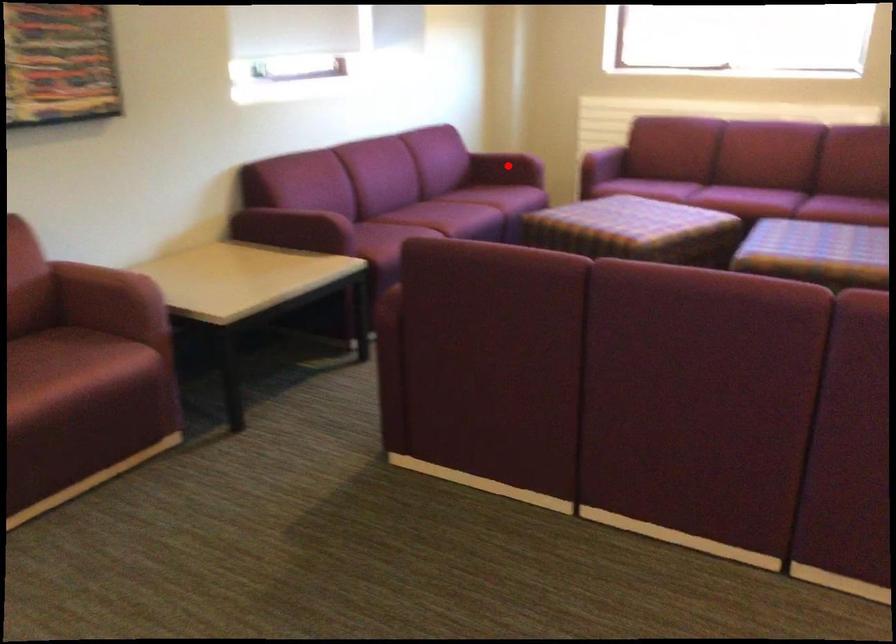
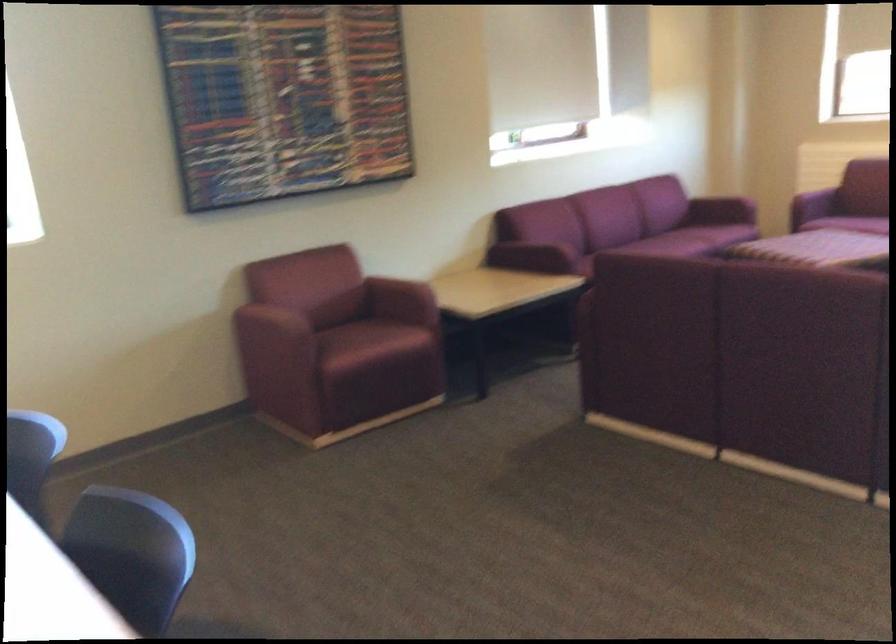
Find the pixel in the second image that matches the highlighted location in the first image.

(720, 211)